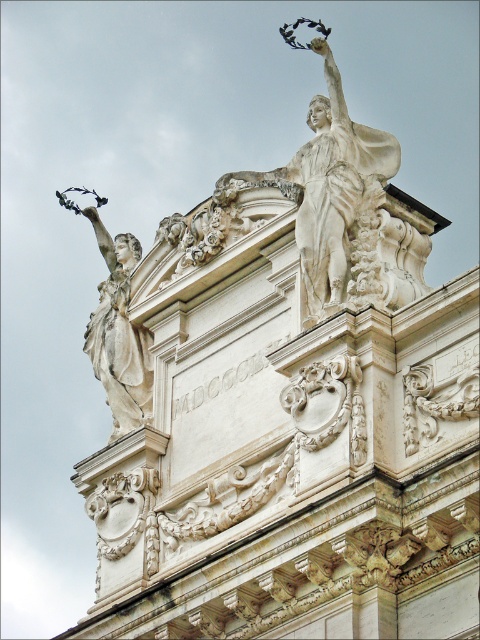
You are an art conservator examining the facade of this historical building. You need to clean both the white marble statue at upper center and the white marble statue at left. Which statue should you start with first to avoid getting the other statue dirty?

You should start with the white marble statue at upper center first because it is in front of the white marble statue at left. Cleaning the front statue first will prevent cleaning debris or water from splashing onto the statue behind it.

Based on the scene description, where is the white marble statue at upper center located in terms of its 2D coordinates?

The white marble statue at upper center is located at the 2D coordinates of point (x=345, y=209).